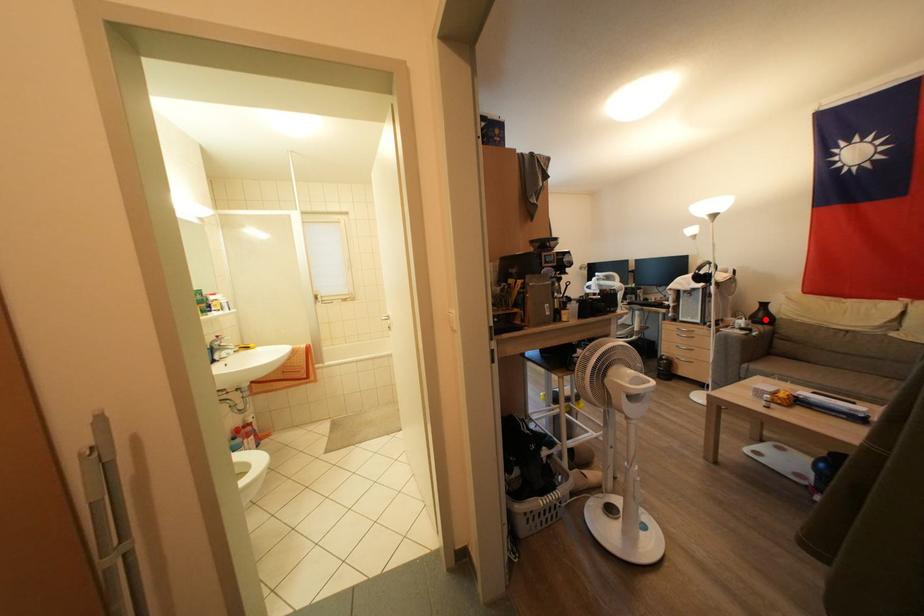
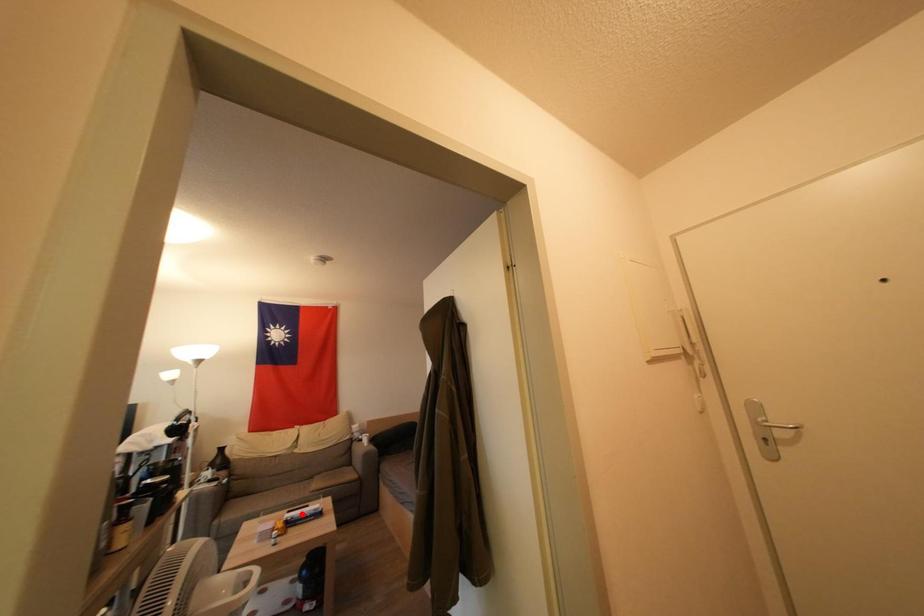
I am providing you with two images of the same scene from different viewpoints. A red point is marked on the first image and another point is marked on the second image. Is the red point in image1 aligned with the point shown in image2?

No